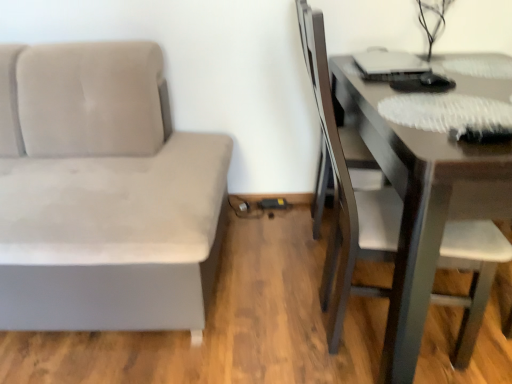
Question: Can you confirm if suede gray couch at left is shorter than matte black swivel chair at right?

Choices:
 (A) no
 (B) yes

Answer: (B)

Question: Would you say suede gray couch at left is outside matte black swivel chair at right?

Choices:
 (A) yes
 (B) no

Answer: (A)

Question: Is suede gray couch at left positioned with its back to matte black swivel chair at right?

Choices:
 (A) no
 (B) yes

Answer: (A)

Question: Is suede gray couch at left directly adjacent to matte black swivel chair at right?

Choices:
 (A) yes
 (B) no

Answer: (B)

Question: Is suede gray couch at left wider than matte black swivel chair at right?

Choices:
 (A) no
 (B) yes

Answer: (B)

Question: Is matte black swivel chair at right inside the boundaries of suede gray couch at left, or outside?

Choices:
 (A) inside
 (B) outside

Answer: (B)

Question: Is matte black swivel chair at right taller or shorter than suede gray couch at left?

Choices:
 (A) tall
 (B) short

Answer: (A)

Question: Is matte black swivel chair at right wider or thinner than suede gray couch at left?

Choices:
 (A) thin
 (B) wide

Answer: (A)

Question: Is matte black swivel chair at right in front of or behind suede gray couch at left in the image?

Choices:
 (A) front
 (B) behind

Answer: (B)

Question: From the image's perspective, is dark brown wooden table at right above or below matte black swivel chair at right?

Choices:
 (A) above
 (B) below

Answer: (B)

Question: Is dark brown wooden table at right inside the boundaries of matte black swivel chair at right, or outside?

Choices:
 (A) inside
 (B) outside

Answer: (B)

Question: Is point (487, 206) positioned closer to the camera than point (323, 175)?

Choices:
 (A) closer
 (B) farther

Answer: (A)

Question: Based on their positions, is dark brown wooden table at right located to the left or right of matte black swivel chair at right?

Choices:
 (A) left
 (B) right

Answer: (B)

Question: Is suede gray couch at left inside the boundaries of matte black swivel chair at right, or outside?

Choices:
 (A) outside
 (B) inside

Answer: (A)

Question: In terms of width, does suede gray couch at left look wider or thinner when compared to matte black swivel chair at right?

Choices:
 (A) thin
 (B) wide

Answer: (B)